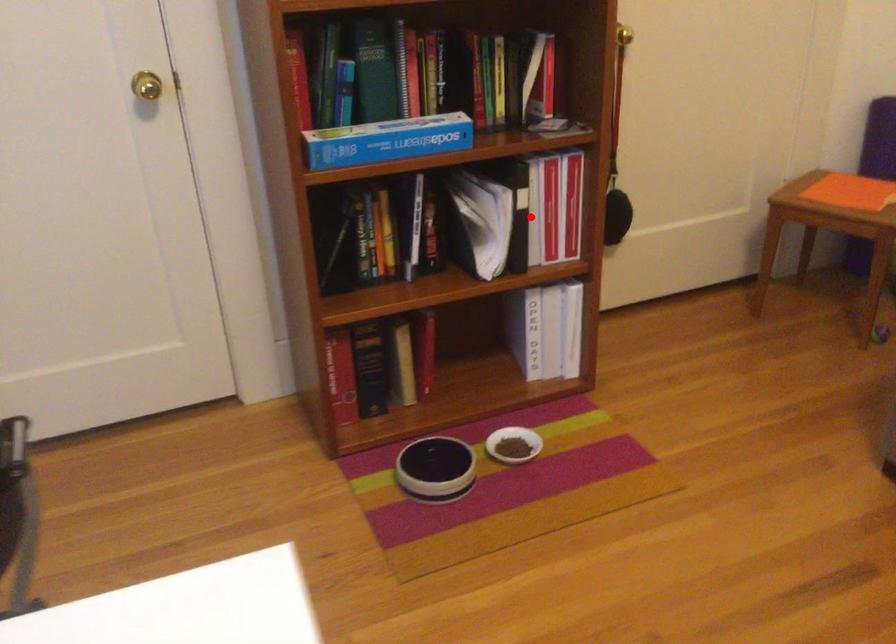
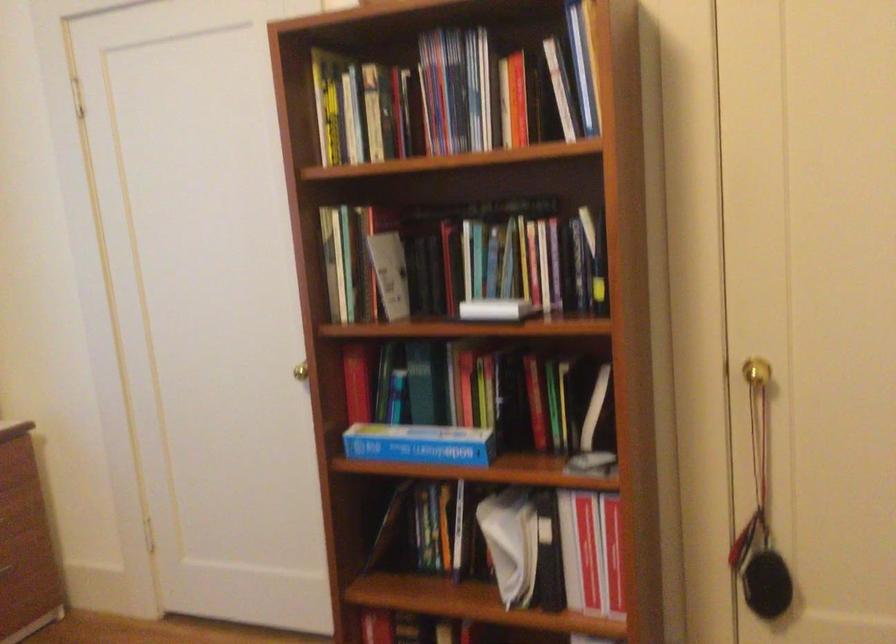
Locate, in the second image, the point that corresponds to the highlighted location in the first image.

(570, 552)